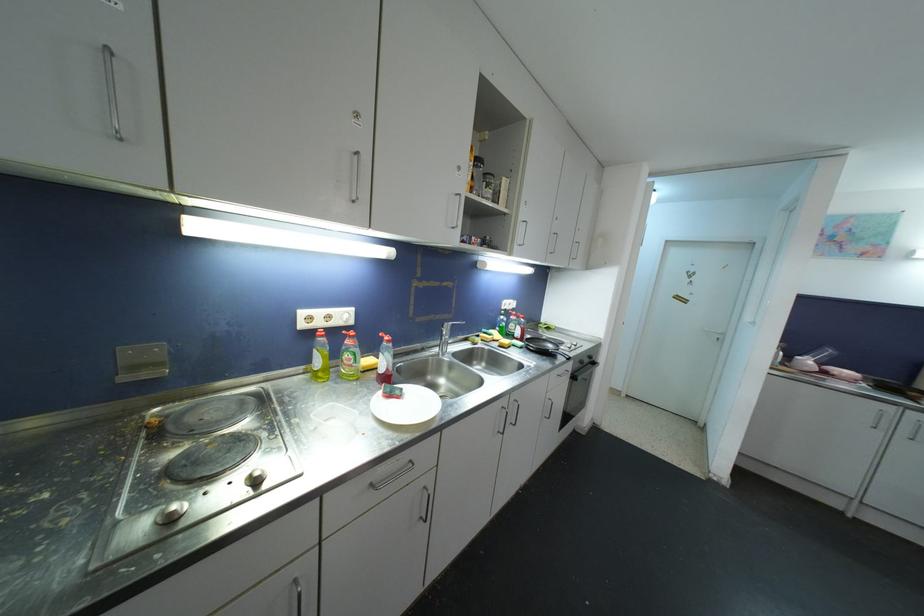
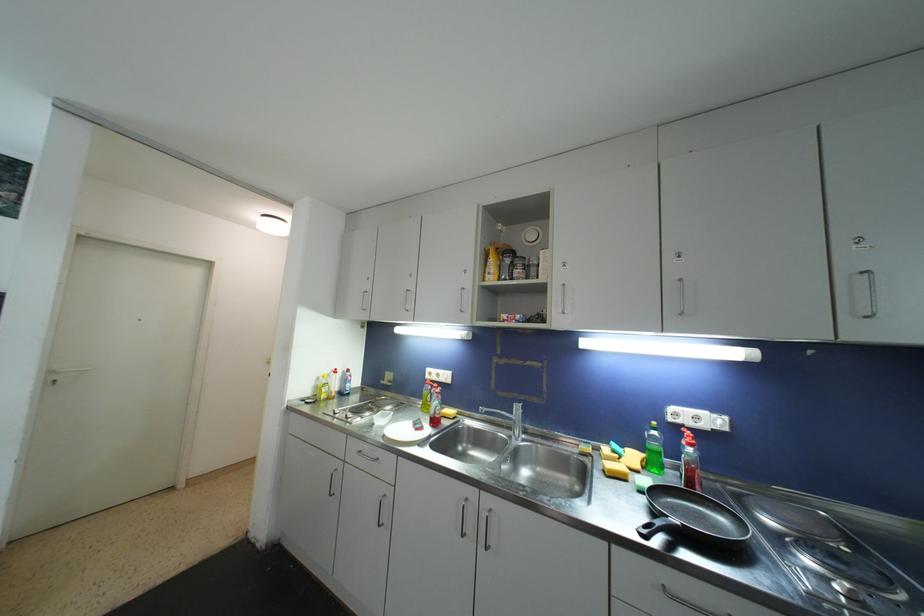
Find the pixel in the second image that matches point 514,310 in the first image.

(708, 429)